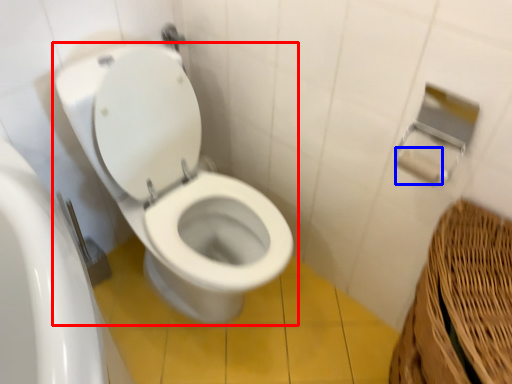
Question: Among these objects, which one is farthest to the camera, toilet (highlighted by a red box) or toilet paper (highlighted by a blue box)?

Choices:
 (A) toilet
 (B) toilet paper

Answer: (B)